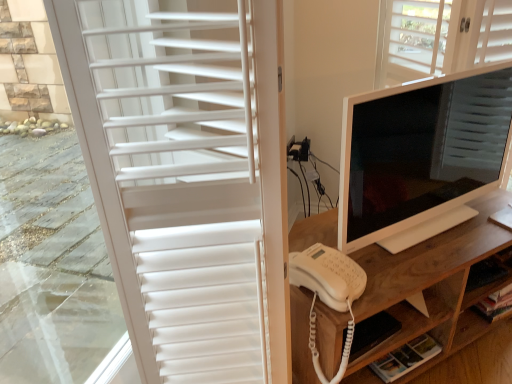
Question: Is white wood shelf at lower right not within wooden desk at center?

Choices:
 (A) no
 (B) yes

Answer: (A)

Question: From the image's perspective, is white wood shelf at lower right on wooden desk at center?

Choices:
 (A) yes
 (B) no

Answer: (B)

Question: Does white wood shelf at lower right turn towards wooden desk at center?

Choices:
 (A) yes
 (B) no

Answer: (A)

Question: Is white wood shelf at lower right wider than wooden desk at center?

Choices:
 (A) yes
 (B) no

Answer: (B)

Question: From a real-world perspective, is white wood shelf at lower right below wooden desk at center?

Choices:
 (A) yes
 (B) no

Answer: (A)

Question: Does point (87, 33) appear closer or farther from the camera than point (340, 167)?

Choices:
 (A) farther
 (B) closer

Answer: (B)

Question: Is white matte shutter at left in front of or behind white glossy monitor at center in the image?

Choices:
 (A) behind
 (B) front

Answer: (B)

Question: From the image's perspective, is white matte shutter at left located above or below white glossy monitor at center?

Choices:
 (A) above
 (B) below

Answer: (B)

Question: In terms of width, does white matte shutter at left look wider or thinner when compared to white glossy monitor at center?

Choices:
 (A) thin
 (B) wide

Answer: (B)

Question: From a real-world perspective, relative to wooden desk at center, is white matte shutter at left vertically above or below?

Choices:
 (A) above
 (B) below

Answer: (A)

Question: Visually, is white matte shutter at left positioned to the left or to the right of wooden desk at center?

Choices:
 (A) right
 (B) left

Answer: (B)

Question: Looking at the image, does white matte shutter at left seem bigger or smaller compared to wooden desk at center?

Choices:
 (A) big
 (B) small

Answer: (B)

Question: Is white matte shutter at left inside the boundaries of wooden desk at center, or outside?

Choices:
 (A) inside
 (B) outside

Answer: (B)

Question: From a real-world perspective, is white matte shutter at left positioned above or below white plastic telephone at center?

Choices:
 (A) below
 (B) above

Answer: (B)

Question: Relative to white plastic telephone at center, is white matte shutter at left in front or behind?

Choices:
 (A) behind
 (B) front

Answer: (B)